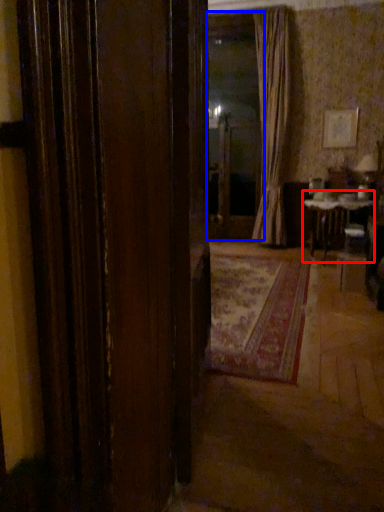
Question: Which object is further to the camera taking this photo, table (highlighted by a red box) or window screen (highlighted by a blue box)?

Choices:
 (A) table
 (B) window screen

Answer: (B)